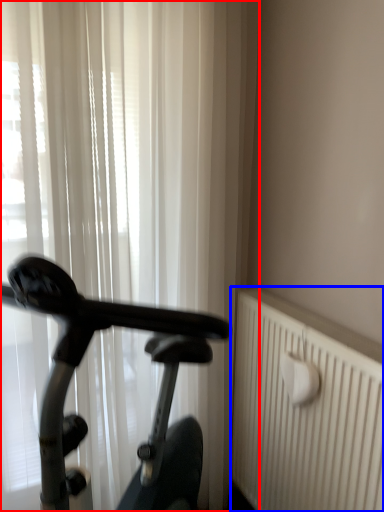
Question: Which point is closer to the camera, curtain (highlighted by a red box) or radiator (highlighted by a blue box)?

Choices:
 (A) curtain
 (B) radiator

Answer: (B)